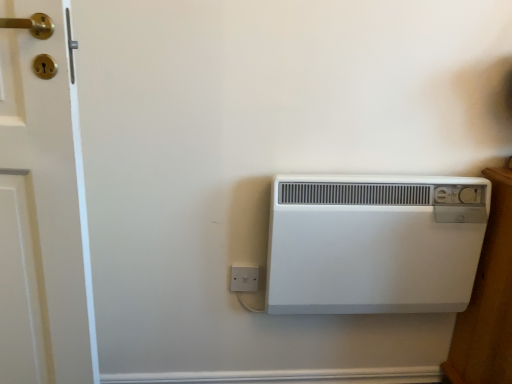
I want to click on white plastic heater at center, so click(x=374, y=243).

The height and width of the screenshot is (384, 512). Describe the element at coordinates (374, 243) in the screenshot. I see `white plastic heater at center` at that location.

Measure the distance between point (257, 287) and camera.

Point (257, 287) and camera are 1.29 meters apart.

This screenshot has height=384, width=512. What do you see at coordinates (244, 279) in the screenshot?
I see `white plastic electric outlet at lower center` at bounding box center [244, 279].

Identify the location of white plastic electric outlet at lower center. The image size is (512, 384). (244, 279).

This screenshot has width=512, height=384. I want to click on white plastic heater at center, so click(x=374, y=243).

Considering the relative positions of white plastic electric outlet at lower center and white plastic heater at center in the image provided, is white plastic electric outlet at lower center to the right of white plastic heater at center from the viewer's perspective?

No, white plastic electric outlet at lower center is not to the right of white plastic heater at center.

Is white plastic electric outlet at lower center further to camera compared to white plastic heater at center?

Yes.

Is point (248, 277) farther from camera compared to point (388, 283)?

Yes, it is behind point (388, 283).

From the image's perspective, does white plastic electric outlet at lower center appear lower than white plastic heater at center?

Yes.

From a real-world perspective, is white plastic electric outlet at lower center positioned above or below white plastic heater at center?

white plastic electric outlet at lower center is below white plastic heater at center.

Considering the relative sizes of white plastic electric outlet at lower center and white plastic heater at center in the image provided, is white plastic electric outlet at lower center wider than white plastic heater at center?

No.

In terms of height, does white plastic electric outlet at lower center look taller or shorter compared to white plastic heater at center?

In the image, white plastic electric outlet at lower center appears to be shorter than white plastic heater at center.

Can you confirm if white plastic electric outlet at lower center is bigger than white plastic heater at center?

Actually, white plastic electric outlet at lower center might be smaller than white plastic heater at center.

Is white plastic electric outlet at lower center located outside white plastic heater at center?

That's correct, white plastic electric outlet at lower center is outside of white plastic heater at center.

Is white plastic electric outlet at lower center beside white plastic heater at center?

No, white plastic electric outlet at lower center is not with white plastic heater at center.

Is white plastic electric outlet at lower center looking in the opposite direction of white plastic heater at center?

That's not correct — white plastic electric outlet at lower center is not looking away from white plastic heater at center.

How many degrees apart are the facing directions of white plastic electric outlet at lower center and white plastic heater at center?

1.57 degrees.

Find the location of a particular element. home appliance that appears above the white plastic electric outlet at lower center (from the image's perspective) is located at coordinates (374, 243).

Between white plastic heater at center and white plastic electric outlet at lower center, which one appears on the left side from the viewer's perspective?

white plastic electric outlet at lower center.

Which object is closer to the camera, white plastic heater at center or white plastic electric outlet at lower center?

Positioned in front is white plastic heater at center.

Is point (368, 302) farther from viewer compared to point (248, 271)?

No.

From the image's perspective, is white plastic heater at center on white plastic electric outlet at lower center?

Yes, from the image's perspective, white plastic heater at center is over white plastic electric outlet at lower center.

From a real-world perspective, which is physically below, white plastic heater at center or white plastic electric outlet at lower center?

From a 3D spatial view, white plastic electric outlet at lower center is below.

Does white plastic heater at center have a lesser width compared to white plastic electric outlet at lower center?

No, white plastic heater at center is not thinner than white plastic electric outlet at lower center.

Does white plastic heater at center have a greater height compared to white plastic electric outlet at lower center?

Yes, white plastic heater at center is taller than white plastic electric outlet at lower center.

In the scene shown: Can you confirm if white plastic heater at center is smaller than white plastic electric outlet at lower center?

Actually, white plastic heater at center might be larger than white plastic electric outlet at lower center.

Is white plastic heater at center completely or partially outside of white plastic electric outlet at lower center?

Yes, white plastic heater at center is outside of white plastic electric outlet at lower center.

Is white plastic heater at center beside white plastic electric outlet at lower center?

No, white plastic heater at center is not in contact with white plastic electric outlet at lower center.

Is white plastic heater at center facing away from white plastic electric outlet at lower center?

That's not correct — white plastic heater at center is not looking away from white plastic electric outlet at lower center.

What's the angular difference between white plastic heater at center and white plastic electric outlet at lower center's facing directions?

1.57 degrees.

Identify the location of electric outlet below the white plastic heater at center (from the image's perspective). (244, 279).

Where is `electric outlet behind the white plastic heater at center`? The image size is (512, 384). electric outlet behind the white plastic heater at center is located at coordinates (244, 279).

Locate an element on the screen. Image resolution: width=512 pixels, height=384 pixels. home appliance above the white plastic electric outlet at lower center (from the image's perspective) is located at coordinates (374, 243).